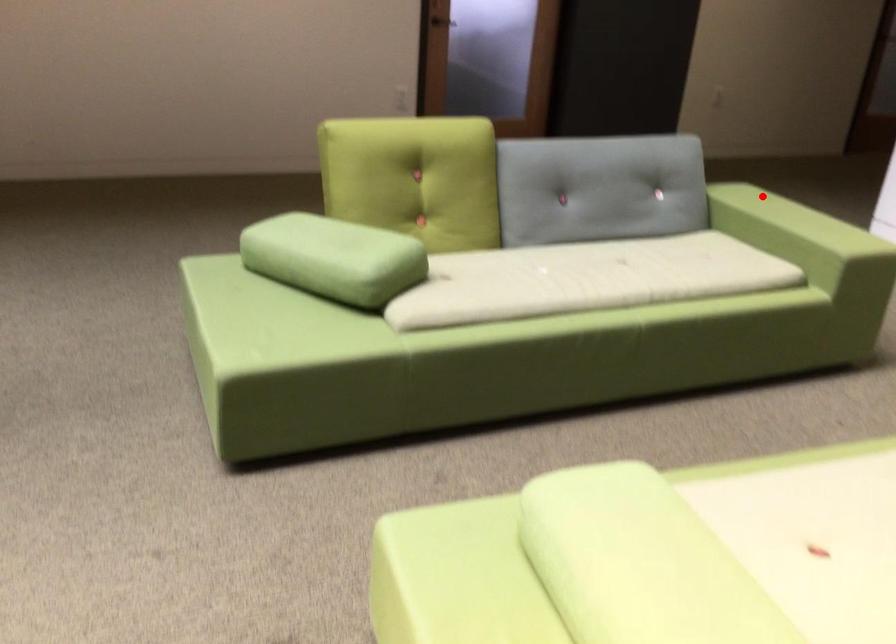
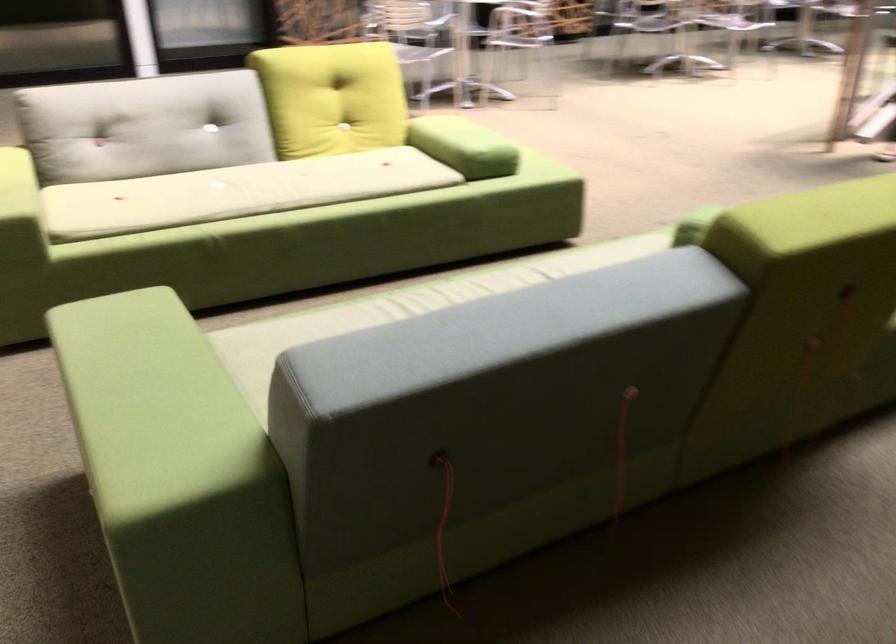
Question: A red point is marked in image1. In image2, is the corresponding 3D point closer to the camera or farther? Reply with the corresponding letter.

Choices:
 (A) The corresponding 3D point is closer.
 (B) The corresponding 3D point is farther.

Answer: (A)